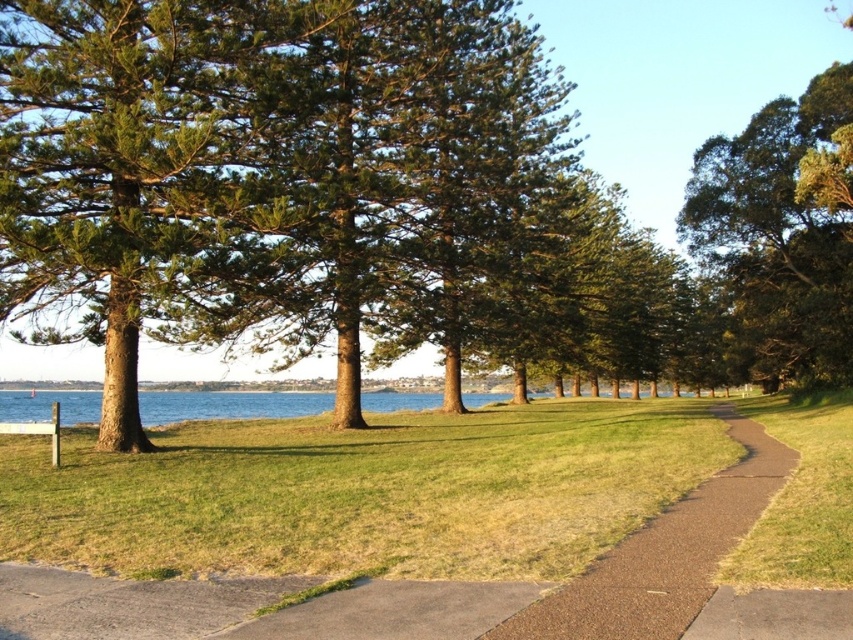
Which is below, green textured pine tree at center or brown asphalt path at center?

brown asphalt path at center is lower down.

Can you confirm if green textured pine tree at center is thinner than brown asphalt path at center?

No.

Locate an element on the screen. green textured pine tree at center is located at coordinates (387, 202).